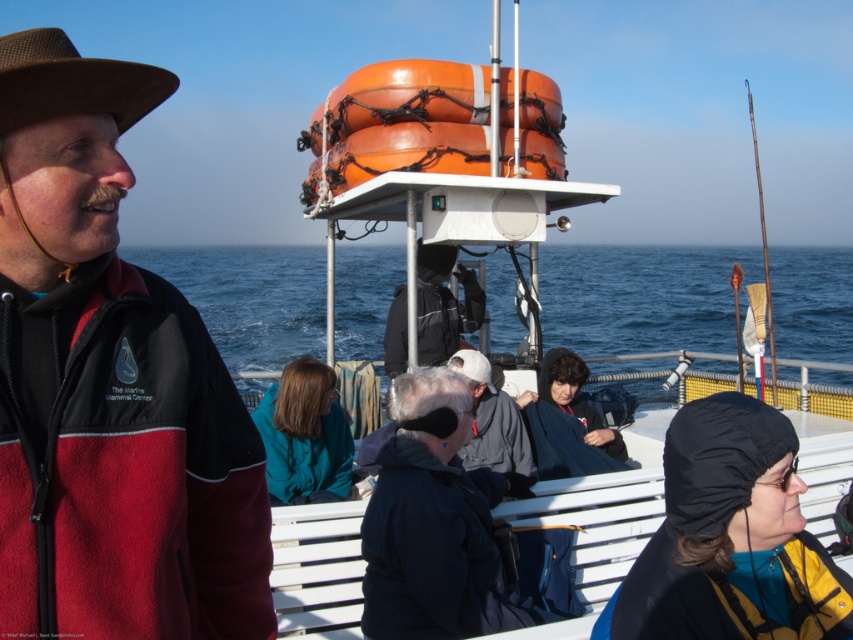
Question: Which point is farther to the camera?

Choices:
 (A) blue water at center
 (B) brown fleece jacket at left
 (C) black fabric backpack at center

Answer: (A)

Question: Is black fleece hat at lower right further to camera compared to dark blue jacket at center?

Choices:
 (A) yes
 (B) no

Answer: (B)

Question: Which of the following is the farthest from the observer?

Choices:
 (A) (15, 102)
 (B) (303, 426)
 (C) (457, 280)
 (D) (555, 326)

Answer: (D)

Question: Does brown felt cowboy hat at left have a greater width compared to black fabric backpack at center?

Choices:
 (A) yes
 (B) no

Answer: (B)

Question: Where is blue water at center located in relation to brown felt cowboy hat at left in the image?

Choices:
 (A) below
 (B) above

Answer: (B)

Question: Among these objects, which one is farthest from the camera?

Choices:
 (A) black fleece hat at lower right
 (B) black fabric backpack at center
 (C) blue water at center

Answer: (C)